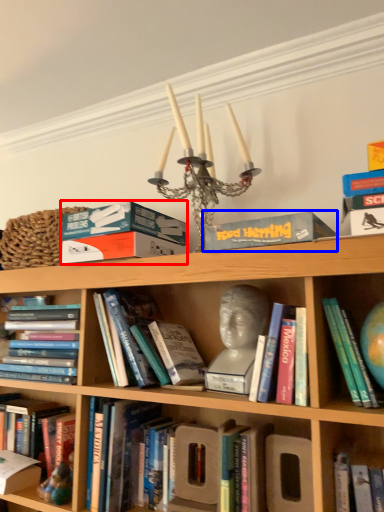
Question: Which of the following is the closest to the observer, paperback book (highlighted by a red box) or paperback book (highlighted by a blue box)?

Choices:
 (A) paperback book
 (B) paperback book

Answer: (B)